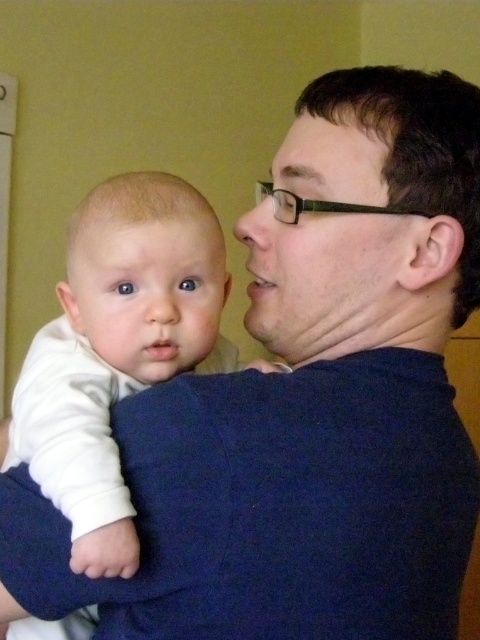
In the scene shown: You are a photographer trying to capture a closeup of both the white soft baby at left and the matte black face at center. Since you want both subjects to appear similarly sized in the photo, which subject should you move closer to the camera and which should you move farther away?

The white soft baby at left is bigger than the matte black face at center. To make them appear similar in size, move the matte black face at center closer to the camera and move the white soft baby at left farther away.

You are a photographer trying to capture a closeup shot of both the matte black face at center and the smooth white baby at center. Given their sizes, which one should you focus on first to ensure both are in frame?

The matte black face at center is larger in size than the smooth white baby at center, so you should focus on the smooth white baby at center first to ensure both fit within the frame.